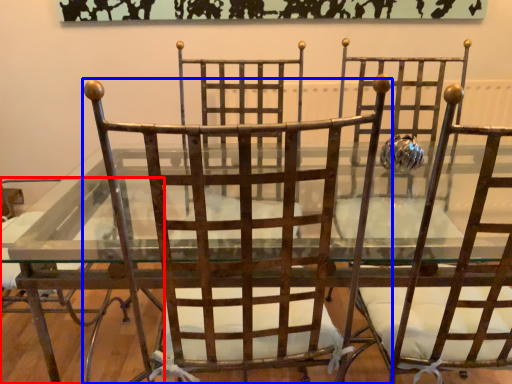
Question: Among these objects, which one is nearest to the camera, chair (highlighted by a red box) or chair (highlighted by a blue box)?

Choices:
 (A) chair
 (B) chair

Answer: (B)